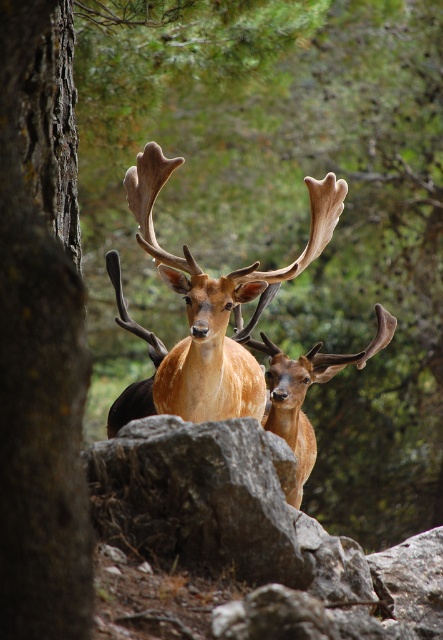
Question: Is golden fur antlers at center to the right of shiny brown antlers at center from the viewer's perspective?

Choices:
 (A) no
 (B) yes

Answer: (A)

Question: Can you confirm if rough bark tree at left is thinner than golden fur antlers at center?

Choices:
 (A) yes
 (B) no

Answer: (A)

Question: Among these objects, which one is farthest from the camera?

Choices:
 (A) shiny brown antlers at center
 (B) rough bark tree at left
 (C) golden fur antlers at center

Answer: (A)

Question: Can you confirm if golden fur antlers at center is positioned below shiny brown antlers at center?

Choices:
 (A) yes
 (B) no

Answer: (B)

Question: Among these points, which one is nearest to the camera?

Choices:
 (A) (175, 272)
 (B) (4, 35)

Answer: (B)

Question: Which point is farther to the camera?

Choices:
 (A) (303, 392)
 (B) (76, 285)

Answer: (A)